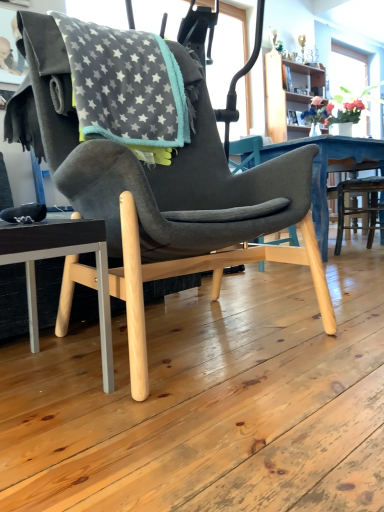
What is the approximate height of gray fleece blanket at upper left?

It is 20.95 inches.

I want to click on gray fleece blanket at upper left, so click(125, 86).

Considering the relative sizes of gray fleece blanket at upper left and wooden bookshelf at upper right in the image provided, is gray fleece blanket at upper left bigger than wooden bookshelf at upper right?

Incorrect, gray fleece blanket at upper left is not larger than wooden bookshelf at upper right.

From a real-world perspective, who is located lower, gray fleece blanket at upper left or wooden bookshelf at upper right?

gray fleece blanket at upper left is physically lower.

Based on their positions, is gray fleece blanket at upper left located to the left or right of wooden bookshelf at upper right?

In the image, gray fleece blanket at upper left appears on the left side of wooden bookshelf at upper right.

Is wooden bookshelf at upper right located within gray fleece blanket at upper left?

No, wooden bookshelf at upper right is not surrounded by gray fleece blanket at upper left.

How distant is matte black chair at lower left from gray fleece blanket at upper left?

matte black chair at lower left and gray fleece blanket at upper left are 26.61 inches apart.

From a real-world perspective, does matte black chair at lower left stand above gray fleece blanket at upper left?

No, from a real-world perspective, matte black chair at lower left is not over gray fleece blanket at upper left

The width and height of the screenshot is (384, 512). I want to click on blanket behind the matte black chair at lower left, so click(125, 86).

Is matte black chair at lower left turned away from gray fleece blanket at upper left?

No, gray fleece blanket at upper left is not at the back of matte black chair at lower left.

Is matte black chair at lower left bigger or smaller than wooden bookshelf at upper right?

matte black chair at lower left is smaller than wooden bookshelf at upper right.

Considering the relative sizes of matte black chair at lower left and wooden bookshelf at upper right in the image provided, is matte black chair at lower left thinner than wooden bookshelf at upper right?

Yes, matte black chair at lower left is thinner than wooden bookshelf at upper right.

Considering their positions, is matte black chair at lower left located in front of or behind wooden bookshelf at upper right?

matte black chair at lower left is positioned closer to the viewer than wooden bookshelf at upper right.

From the image's perspective, would you say matte black chair at lower left is shown under wooden bookshelf at upper right?

Answer: Indeed, from the image's perspective, matte black chair at lower left is shown beneath wooden bookshelf at upper right.

Which of these two, gray fleece blanket at upper left or matte black chair at lower left, is smaller?

matte black chair at lower left.

Is gray fleece blanket at upper left aimed at matte black chair at lower left?

No, gray fleece blanket at upper left does not turn towards matte black chair at lower left.

Is gray fleece blanket at upper left completely or partially outside of matte black chair at lower left?

Yes, gray fleece blanket at upper left is not within matte black chair at lower left.

From a real-world perspective, which is physically below, gray fleece blanket at upper left or matte black chair at lower left?

From a 3D spatial view, matte black chair at lower left is below.

In terms of height, does wooden bookshelf at upper right look taller or shorter compared to gray fleece blanket at upper left?

wooden bookshelf at upper right is taller than gray fleece blanket at upper left.

Is wooden bookshelf at upper right positioned far away from gray fleece blanket at upper left?

Yes.

Is wooden bookshelf at upper right directly adjacent to matte black chair at lower left?

No, wooden bookshelf at upper right is not making contact with matte black chair at lower left.

From a real-world perspective, which object stands above the other?

wooden bookshelf at upper right is physically above.

Is matte black chair at lower left at the back of wooden bookshelf at upper right?

That's not correct — wooden bookshelf at upper right is not looking away from matte black chair at lower left.

Is wooden bookshelf at upper right behind matte black chair at lower left?

Yes.

In the image, there is a wooden bookshelf at upper right. Where is `blanket below it (from a real-world perspective)`? This screenshot has width=384, height=512. blanket below it (from a real-world perspective) is located at coordinates (125, 86).

At what (x,y) coordinates should I click in order to perform the action: click on blanket on the right of matte black chair at lower left. Please return your answer as a coordinate pair (x, y). Image resolution: width=384 pixels, height=512 pixels. Looking at the image, I should click on (125, 86).

In the scene shown: Which object lies nearer to the anchor point gray fleece blanket at upper left, matte black chair at lower left or wooden bookshelf at upper right?

Among the two, matte black chair at lower left is located nearer to gray fleece blanket at upper left.

Estimate the real-world distances between objects in this image. Which object is further from matte black chair at lower left, gray fleece blanket at upper left or wooden bookshelf at upper right?

Based on the image, wooden bookshelf at upper right appears to be further to matte black chair at lower left.

Based on their spatial positions, is gray fleece blanket at upper left or matte black chair at lower left closer to wooden bookshelf at upper right?

gray fleece blanket at upper left.

Based on their spatial positions, is wooden bookshelf at upper right or gray fleece blanket at upper left further from matte black chair at lower left?

wooden bookshelf at upper right is further to matte black chair at lower left.

Estimate the real-world distances between objects in this image. Which object is closer to gray fleece blanket at upper left, wooden bookshelf at upper right or matte black chair at lower left?

matte black chair at lower left is positioned closer to the anchor gray fleece blanket at upper left.

Looking at the image, which one is located further to wooden bookshelf at upper right, matte black chair at lower left or gray fleece blanket at upper left?

matte black chair at lower left lies further to wooden bookshelf at upper right than the other object.

The height and width of the screenshot is (512, 384). I want to click on blanket located between matte black chair at lower left and wooden bookshelf at upper right in the depth direction, so click(x=125, y=86).